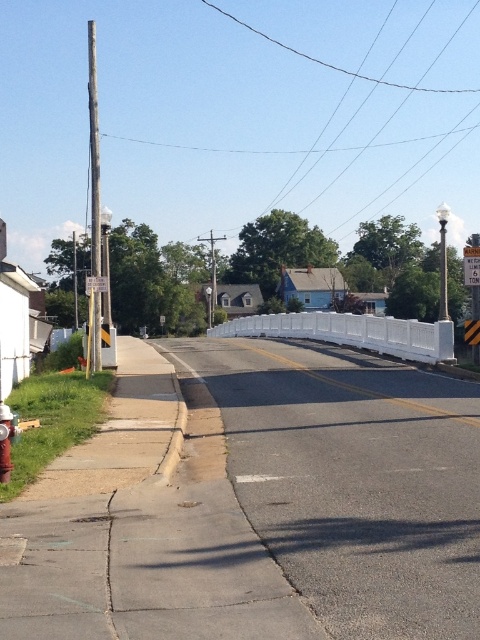
Question: Among these objects, which one is farthest from the camera?

Choices:
 (A) white plastic barricade at center
 (B) red metallic hydrant at lower left

Answer: (A)

Question: Which of the following is the closest to the observer?

Choices:
 (A) (404, 342)
 (B) (6, 412)

Answer: (B)

Question: Can you confirm if white plastic barricade at center is smaller than red metallic hydrant at lower left?

Choices:
 (A) yes
 (B) no

Answer: (B)

Question: Is white plastic barricade at center wider than red metallic hydrant at lower left?

Choices:
 (A) no
 (B) yes

Answer: (B)

Question: Among these points, which one is farthest from the camera?

Choices:
 (A) (1, 410)
 (B) (404, 320)

Answer: (B)

Question: Does white plastic barricade at center have a smaller size compared to red metallic hydrant at lower left?

Choices:
 (A) no
 (B) yes

Answer: (A)